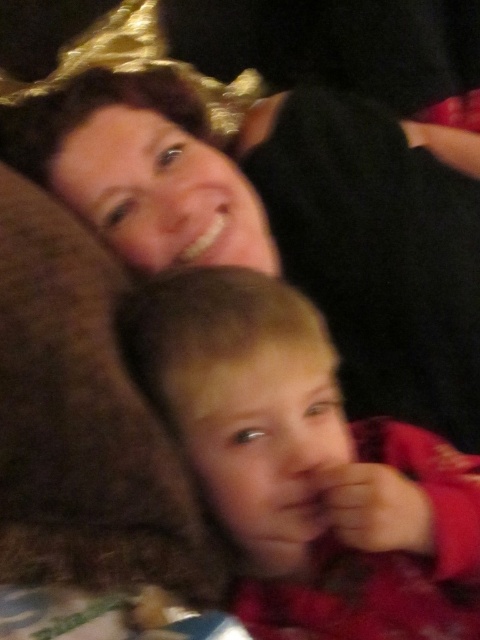
You are trying to locate a specific point in the image. The point is at coordinates point (286, 221). Based on the scene description, what object or feature is located at this point?

The point (286, 221) is located on the matte black hair at upper center.

You are a photographer adjusting the lighting in the scene. To ensure both the matte black hair at upper center and the smooth red shirt at lower center are well lit, which object should you move closer to the light source?

The smooth red shirt at lower center is behind matte black hair at upper center, so moving the smooth red shirt at lower center closer to the light source would help illuminate it without blocking the light to the matte black hair at upper center.

You are designing a photo frame that needs to accommodate both the matte black hair at upper center and the smooth red shirt at lower center. Given their widths, which object requires a wider space in the frame?

The matte black hair at upper center requires a wider space in the frame because its width surpasses that of the smooth red shirt at lower center.